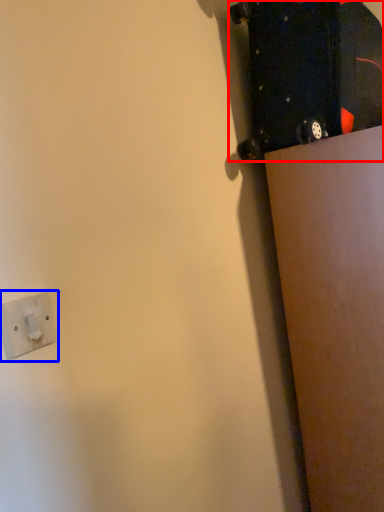
Question: Among these objects, which one is farthest to the camera, skateboard (highlighted by a red box) or socket (highlighted by a blue box)?

Choices:
 (A) skateboard
 (B) socket

Answer: (A)